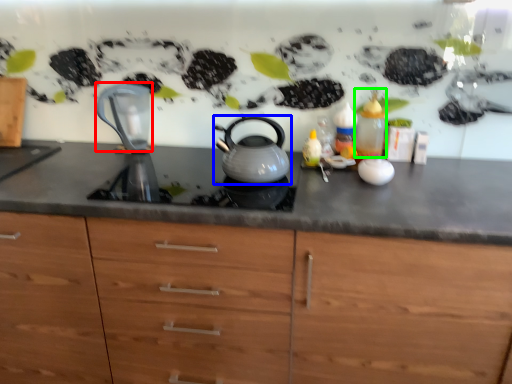
Question: Which object is the farthest from jug (highlighted by a red box)? Choose among these: kettle (highlighted by a blue box) or bottle (highlighted by a green box).

Choices:
 (A) kettle
 (B) bottle

Answer: (B)